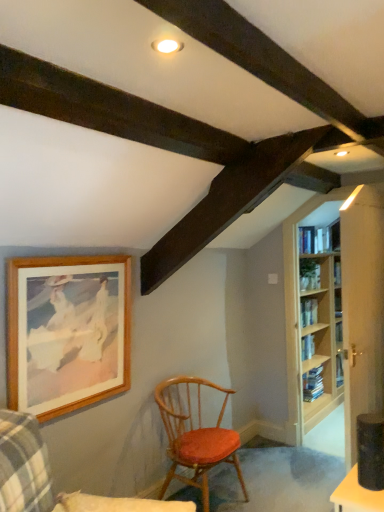
Question: Is wooden chair with red cushion at center, the first chair from the front, outside light wood bookcase at right?

Choices:
 (A) no
 (B) yes

Answer: (B)

Question: Could light wood bookcase at right be considered to be inside wooden chair with red cushion at center, the second chair from the back?

Choices:
 (A) no
 (B) yes

Answer: (A)

Question: Does wooden chair with red cushion at center, the second chair from the back, come behind light wood bookcase at right?

Choices:
 (A) yes
 (B) no

Answer: (B)

Question: Are wooden chair with red cushion at center, the second chair from the back, and light wood bookcase at right far apart?

Choices:
 (A) no
 (B) yes

Answer: (B)

Question: Is wooden chair with red cushion at center, the second chair from the back, facing away from light wood bookcase at right?

Choices:
 (A) yes
 (B) no

Answer: (B)

Question: From a real-world perspective, is wooden chair with red cushion at center, the second chair from the back, above or below light wood bookcase at right?

Choices:
 (A) above
 (B) below

Answer: (B)

Question: From their relative heights in the image, would you say wooden chair with red cushion at center, the second chair from the back, is taller or shorter than light wood bookcase at right?

Choices:
 (A) short
 (B) tall

Answer: (A)

Question: From the image's perspective, is wooden chair with red cushion at center, the second chair from the back, positioned above or below light wood bookcase at right?

Choices:
 (A) above
 (B) below

Answer: (B)

Question: Considering the relative positions of wooden chair with red cushion at center, the second chair from the back, and light wood bookcase at right in the image provided, is wooden chair with red cushion at center, the second chair from the back, to the left or to the right of light wood bookcase at right?

Choices:
 (A) left
 (B) right

Answer: (A)

Question: From a real-world perspective, is wooden chair with red cushion at center, the first chair from the back, physically located above or below wooden picture frame at upper left?

Choices:
 (A) below
 (B) above

Answer: (A)

Question: From their relative heights in the image, would you say wooden chair with red cushion at center, acting as the 2th chair starting from the front, is taller or shorter than wooden picture frame at upper left?

Choices:
 (A) tall
 (B) short

Answer: (B)

Question: In terms of width, does wooden chair with red cushion at center, the first chair from the back, look wider or thinner when compared to wooden picture frame at upper left?

Choices:
 (A) thin
 (B) wide

Answer: (B)

Question: Considering the positions of point (196, 377) and point (124, 300), is point (196, 377) closer or farther from the camera than point (124, 300)?

Choices:
 (A) farther
 (B) closer

Answer: (A)

Question: Is light wood bookcase at right taller or shorter than wooden chair with red cushion at center, the first chair from the back?

Choices:
 (A) tall
 (B) short

Answer: (A)

Question: Is point (380, 315) closer or farther from the camera than point (210, 455)?

Choices:
 (A) closer
 (B) farther

Answer: (B)